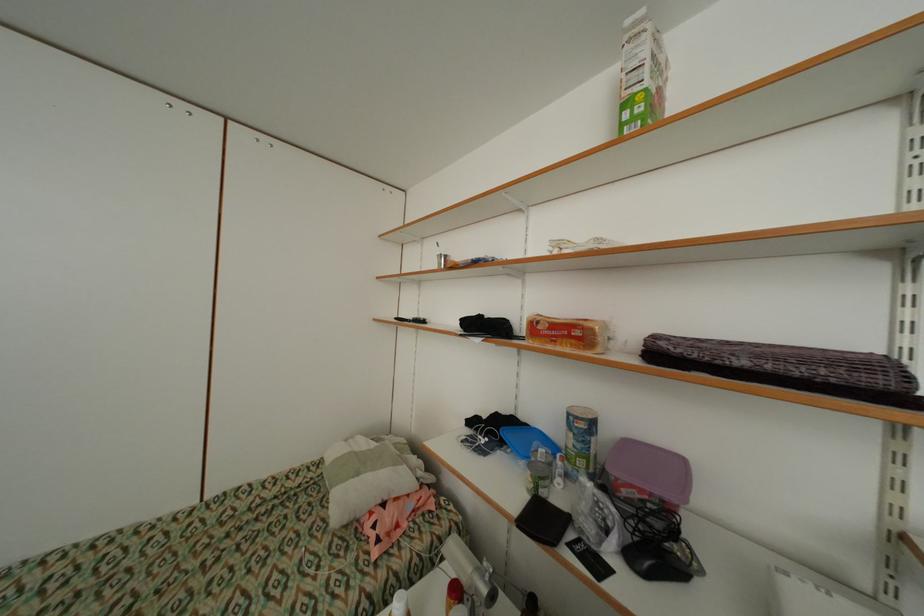
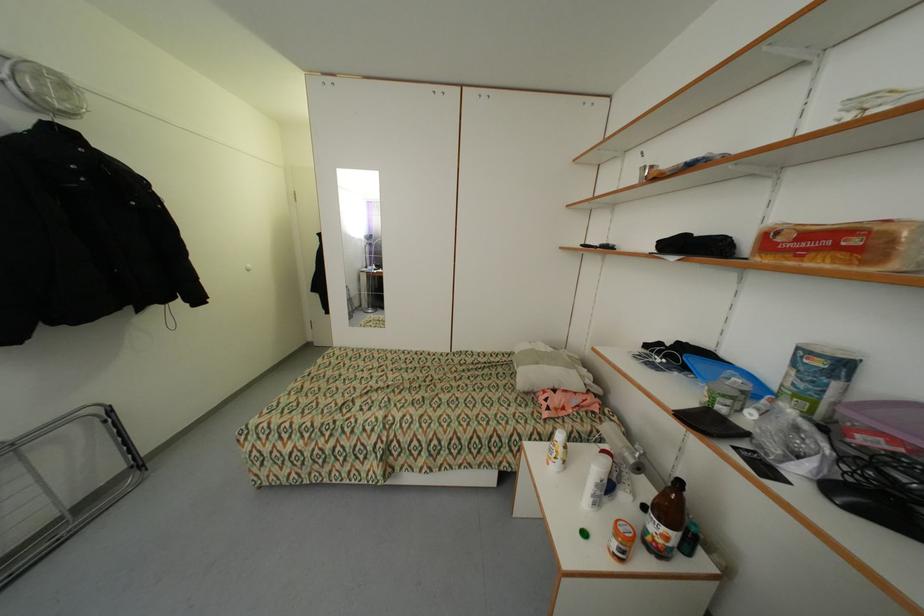
The point at [508,445] is marked in the first image. Where is the corresponding point in the second image?

(690, 369)